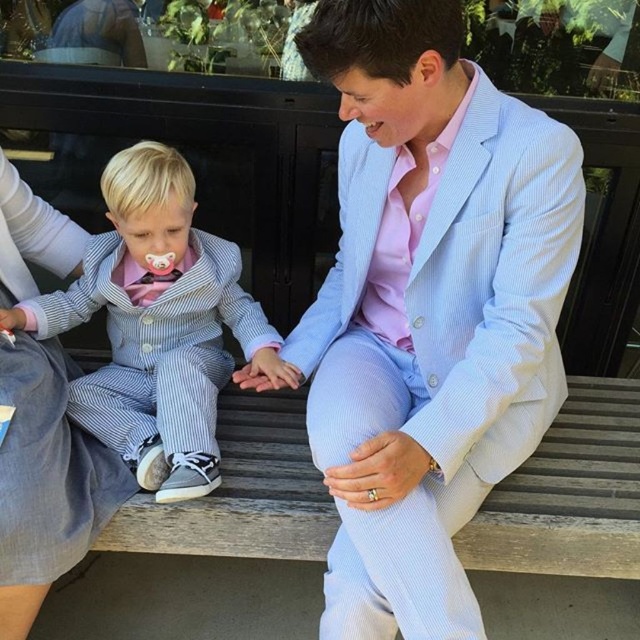
The two individuals are sitting on a bench. The adult is wearing a light blue seersucker suit at center, and the child is wearing a light blue striped suit at center. If the adult wants to place a small toy between them, how far apart should they place it?

The light blue seersucker suit at center is 25.83 inches from the light blue striped suit at center, so the adult should place the small toy approximately 12.915 inches away from each suit.

You are a photographer trying to capture a closeup of both the light blue seersucker suit at center and the striped fabric suit at left. Which one should you focus on first to ensure it appears sharp in the photo?

You should focus on the light blue seersucker suit at center first because it is closer to the viewer than the striped fabric suit at left, so focusing on the closer one first will ensure it appears sharp.

You are a photographer trying to capture a closeup of the striped fabric suit at left and the light blue striped suit at center. What is the minimum distance you need to set your camera to focus on both subjects clearly?

The minimum distance you need to set your camera is 8.16 inches because the striped fabric suit at left is 8.16 inches away from the light blue striped suit at center.